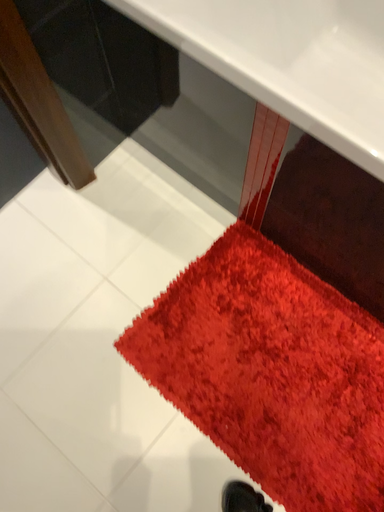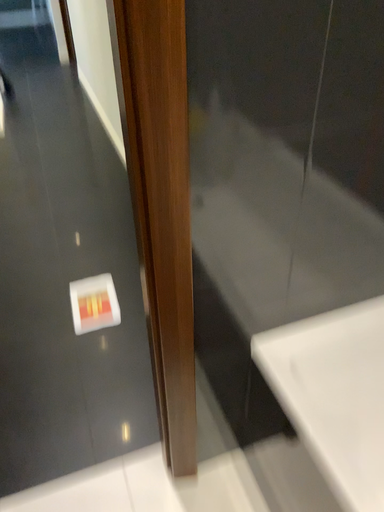
Question: Which way did the camera rotate in the video?

Choices:
 (A) rotated right
 (B) rotated left

Answer: (B)